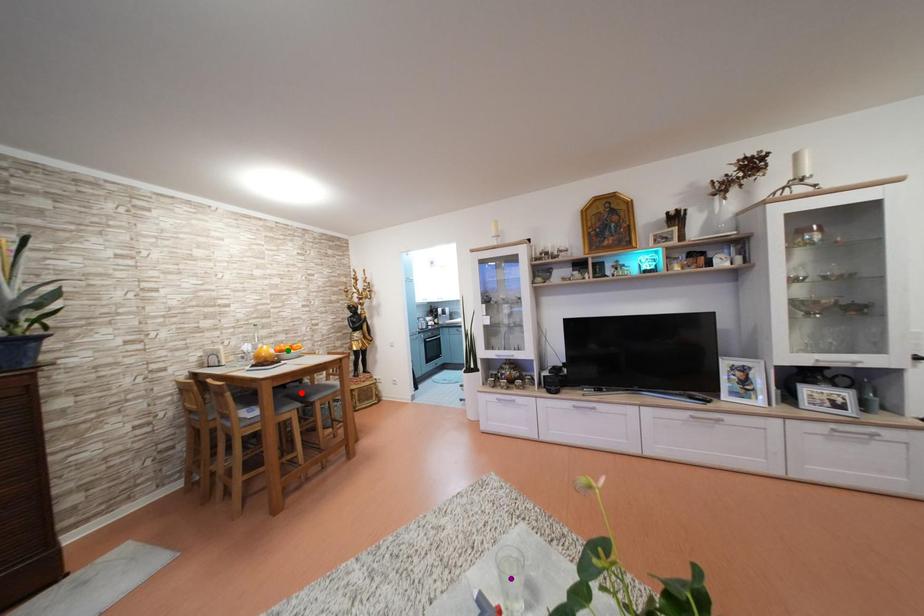
Order these from nearest to farthest:
green point, red point, purple point

1. green point
2. red point
3. purple point